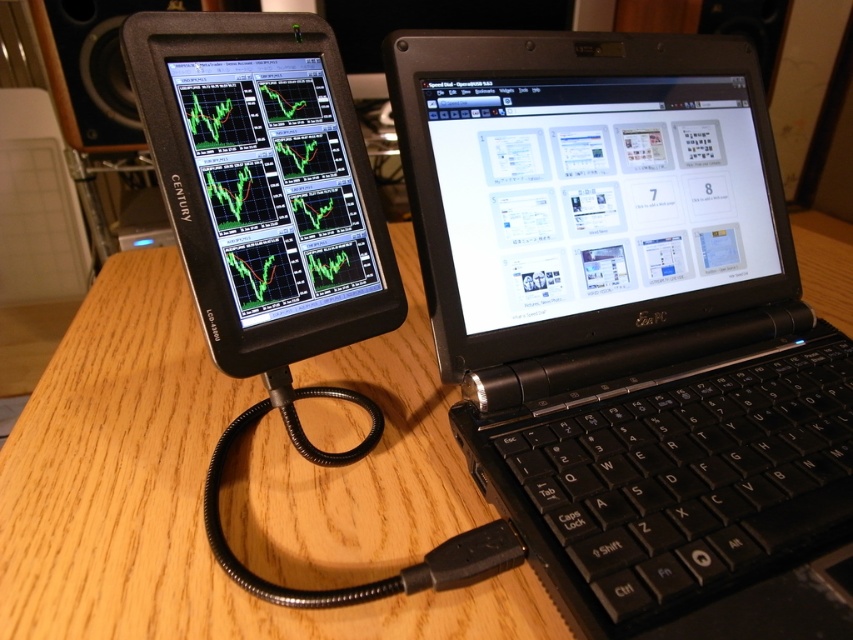
Can you confirm if black plastic laptop at center is shorter than matte black screen at center?

Incorrect, black plastic laptop at center's height does not fall short of matte black screen at center's.

Image resolution: width=853 pixels, height=640 pixels. Describe the element at coordinates (630, 326) in the screenshot. I see `black plastic laptop at center` at that location.

Does point (560, 413) lie in front of point (720, 173)?

Yes, point (560, 413) is closer to viewer.

At what (x,y) coordinates should I click in order to perform the action: click on black plastic laptop at center. Please return your answer as a coordinate pair (x, y). The height and width of the screenshot is (640, 853). Looking at the image, I should click on (630, 326).

In the scene shown: Between black plastic laptop at center and matte black screen at left, which one appears on the right side from the viewer's perspective?

From the viewer's perspective, black plastic laptop at center appears more on the right side.

Can you confirm if black plastic laptop at center is positioned to the right of matte black screen at left?

Correct, you'll find black plastic laptop at center to the right of matte black screen at left.

The height and width of the screenshot is (640, 853). Describe the element at coordinates (630, 326) in the screenshot. I see `black plastic laptop at center` at that location.

Locate an element on the screen. The image size is (853, 640). black plastic laptop at center is located at coordinates (630, 326).

Is wooden table at center bigger than matte black screen at center?

Indeed, wooden table at center has a larger size compared to matte black screen at center.

From the picture: Does wooden table at center have a greater height compared to matte black screen at center?

Yes, wooden table at center is taller than matte black screen at center.

What do you see at coordinates (167, 493) in the screenshot? Image resolution: width=853 pixels, height=640 pixels. I see `wooden table at center` at bounding box center [167, 493].

At what (x,y) coordinates should I click in order to perform the action: click on wooden table at center. Please return your answer as a coordinate pair (x, y). The image size is (853, 640). Looking at the image, I should click on (167, 493).